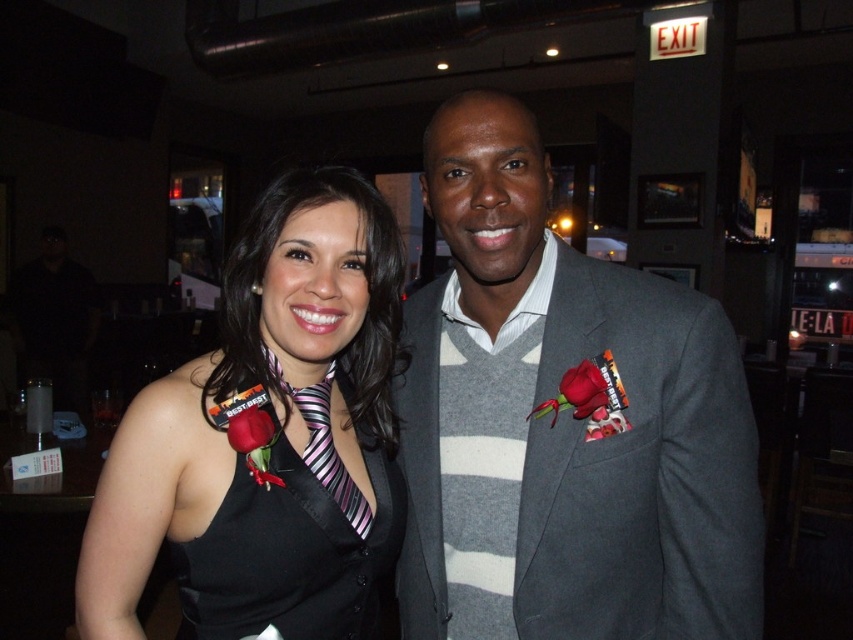
Between black satin dress at left and striped fabric tie at center, which one has more height?

With more height is black satin dress at left.

At what (x,y) coordinates should I click in order to perform the action: click on black satin dress at left. Please return your answer as a coordinate pair (x, y). Looking at the image, I should click on (276, 444).

At what (x,y) coordinates should I click in order to perform the action: click on black satin dress at left. Please return your answer as a coordinate pair (x, y). Image resolution: width=853 pixels, height=640 pixels. Looking at the image, I should click on (276, 444).

Does gray wool suit at center lie in front of striped fabric tie at center?

Yes.

From the picture: Is gray wool suit at center above striped fabric tie at center?

Indeed, gray wool suit at center is positioned over striped fabric tie at center.

Which is behind, point (711, 580) or point (318, 429)?

Positioned behind is point (318, 429).

You are a GUI agent. You are given a task and a screenshot of the screen. Output one action in this format:
    pyautogui.click(x=<x>, y=<y>)
    Task: Click on the gray wool suit at center
    The image size is (853, 640).
    Given the screenshot: What is the action you would take?
    pyautogui.click(x=563, y=422)

Is gray wool suit at center bigger than black satin dress at left?

Yes, gray wool suit at center is bigger than black satin dress at left.

Where is `gray wool suit at center`? Image resolution: width=853 pixels, height=640 pixels. gray wool suit at center is located at coordinates (563, 422).